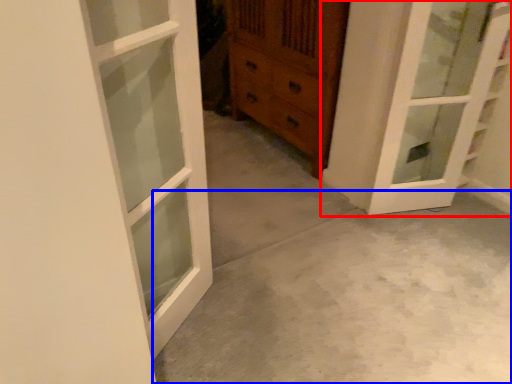
Question: Which object is further to the camera taking this photo, door (highlighted by a red box) or concrete (highlighted by a blue box)?

Choices:
 (A) door
 (B) concrete

Answer: (A)